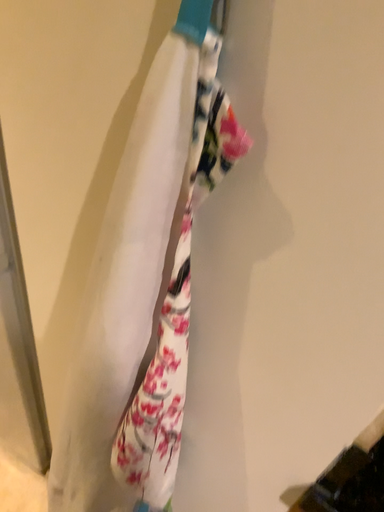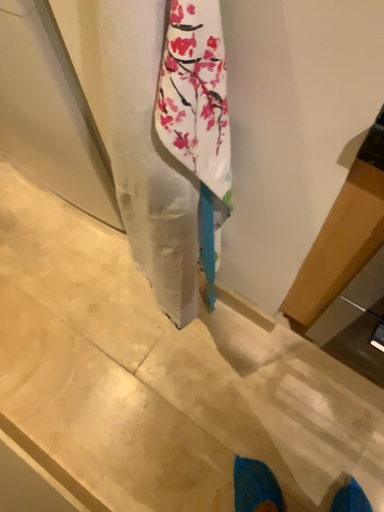
Question: How did the camera likely rotate when shooting the video?

Choices:
 (A) rotated right
 (B) rotated left

Answer: (B)